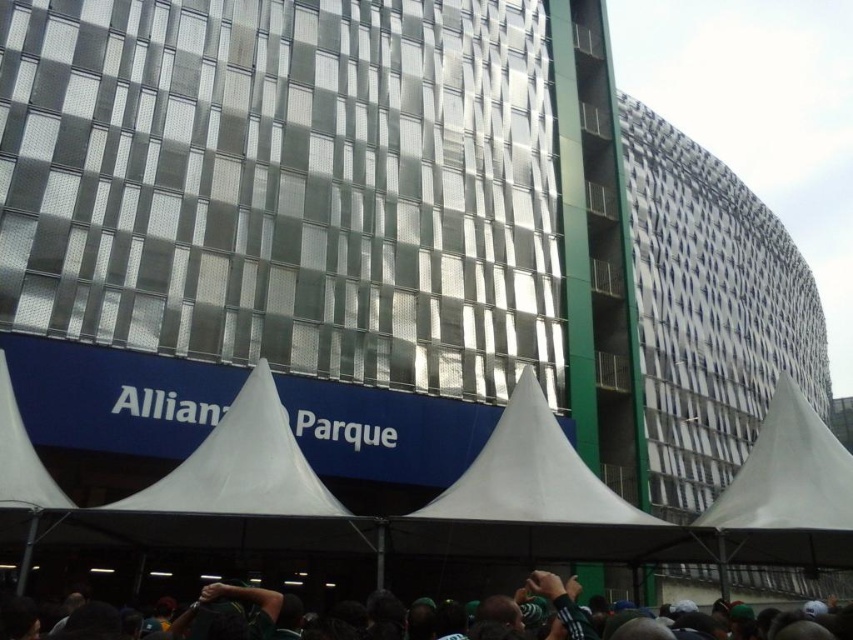
Can you confirm if dark green fabric at lower center is wider than white fabric canopy at lower left?

Correct, the width of dark green fabric at lower center exceeds that of white fabric canopy at lower left.

Between dark green fabric at lower center and white fabric canopy at lower left, which one has less height?

white fabric canopy at lower left is shorter.

What do you see at coordinates (225, 614) in the screenshot? This screenshot has height=640, width=853. I see `dark green fabric at lower center` at bounding box center [225, 614].

Where is `dark green fabric at lower center`? The width and height of the screenshot is (853, 640). dark green fabric at lower center is located at coordinates (225, 614).